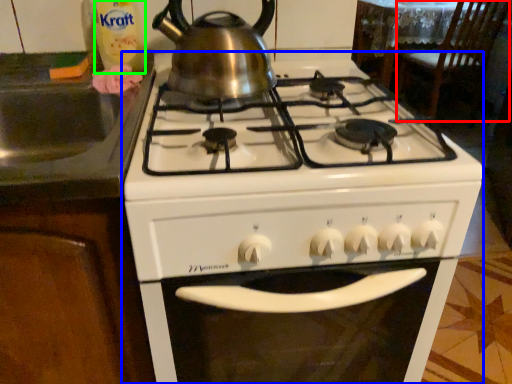
Question: Which object is the farthest from chair (highlighted by a red box)? Choose among these: gas stove (highlighted by a blue box) or bottle (highlighted by a green box).

Choices:
 (A) gas stove
 (B) bottle

Answer: (B)